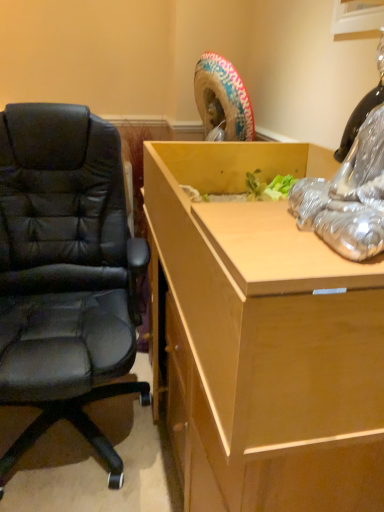
Question: Is black leather chair at left bigger than light brown wood desk at center?

Choices:
 (A) no
 (B) yes

Answer: (B)

Question: From a real-world perspective, is black leather chair at left located higher than light brown wood desk at center?

Choices:
 (A) yes
 (B) no

Answer: (B)

Question: Is black leather chair at left oriented away from light brown wood desk at center?

Choices:
 (A) no
 (B) yes

Answer: (A)

Question: From the image's perspective, is black leather chair at left beneath light brown wood desk at center?

Choices:
 (A) yes
 (B) no

Answer: (A)

Question: Is black leather chair at left placed right next to light brown wood desk at center?

Choices:
 (A) no
 (B) yes

Answer: (A)

Question: From the image's perspective, is black leather chair at left located above light brown wood desk at center?

Choices:
 (A) yes
 (B) no

Answer: (B)

Question: Can you confirm if light brown wood desk at center is shorter than black leather chair at left?

Choices:
 (A) no
 (B) yes

Answer: (B)

Question: Does light brown wood desk at center come behind black leather chair at left?

Choices:
 (A) yes
 (B) no

Answer: (B)

Question: From a real-world perspective, is light brown wood desk at center below black leather chair at left?

Choices:
 (A) yes
 (B) no

Answer: (B)

Question: Would you say light brown wood desk at center is a long distance from black leather chair at left?

Choices:
 (A) no
 (B) yes

Answer: (A)

Question: From the image's perspective, is light brown wood desk at center below black leather chair at left?

Choices:
 (A) no
 (B) yes

Answer: (A)

Question: Is light brown wood desk at center surrounding black leather chair at left?

Choices:
 (A) yes
 (B) no

Answer: (B)

Question: Which is correct: black leather chair at left is inside light brown wood desk at center, or outside of it?

Choices:
 (A) outside
 (B) inside

Answer: (A)